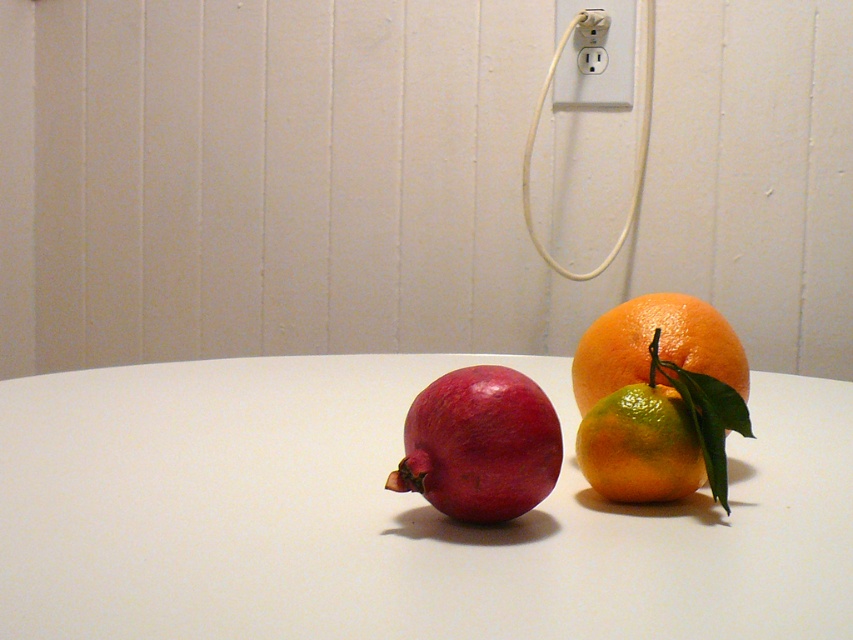
Can you confirm if orange matte at right is bigger than white plastic outlet at upper center?

No, orange matte at right is not bigger than white plastic outlet at upper center.

From the picture: Is orange matte at right above white plastic outlet at upper center?

No, orange matte at right is not above white plastic outlet at upper center.

This screenshot has height=640, width=853. I want to click on orange matte at right, so click(x=659, y=346).

Does matte white table at center have a smaller size compared to shiny green lime at center right?

No, matte white table at center is not smaller than shiny green lime at center right.

From the picture: Does matte white table at center have a larger size compared to shiny green lime at center right?

Correct, matte white table at center is larger in size than shiny green lime at center right.

What are the coordinates of `matte white table at center` in the screenshot? It's located at (390, 515).

Does point (630, 625) lie in front of point (625, 76)?

Yes, point (630, 625) is closer to viewer.

Who is more distant from viewer, [239,506] or [602,26]?

The point [602,26] is behind.

You are a GUI agent. You are given a task and a screenshot of the screen. Output one action in this format:
    pyautogui.click(x=<x>, y=<y>)
    Task: Click on the matte white table at center
    
    Given the screenshot: What is the action you would take?
    pyautogui.click(x=390, y=515)